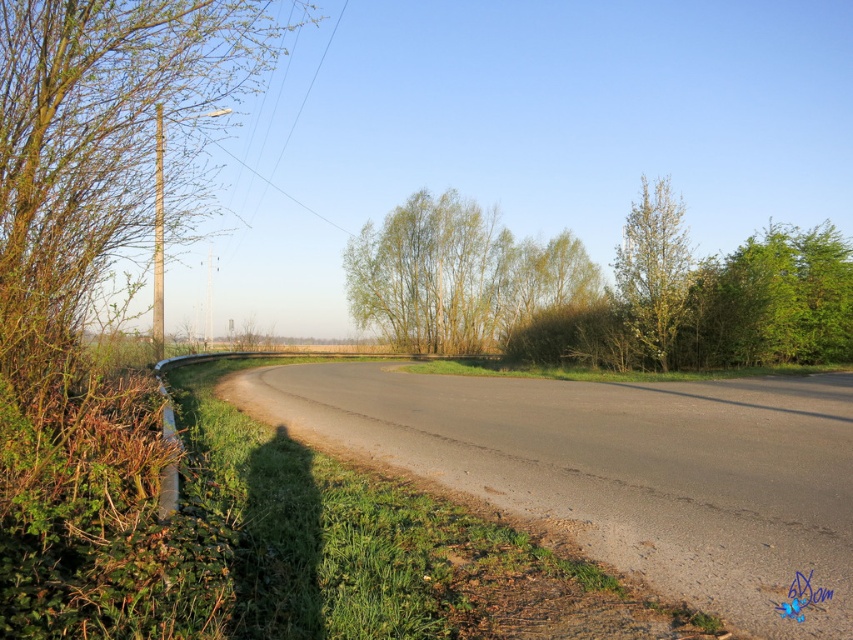
Question: Which point is closer to the camera taking this photo?

Choices:
 (A) (47, 372)
 (B) (398, 237)
 (C) (657, 234)
 (D) (749, 285)

Answer: (A)

Question: Which object appears farthest from the camera in this image?

Choices:
 (A) green leafy tree at right
 (B) green leafy tree at left
 (C) green leafy tree at upper right

Answer: (A)

Question: Observing the image, what is the correct spatial positioning of green leafy tree at left in reference to green leafy trees at center?

Choices:
 (A) above
 (B) below

Answer: (A)

Question: Can you confirm if green leafy trees at center is positioned below green leafy tree at right?

Choices:
 (A) yes
 (B) no

Answer: (B)

Question: Among these points, which one is farthest from the camera?

Choices:
 (A) (0, 97)
 (B) (766, 278)
 (C) (685, 257)
 (D) (368, 236)

Answer: (D)

Question: Does green leafy trees at center lie in front of green leafy tree at upper right?

Choices:
 (A) yes
 (B) no

Answer: (B)